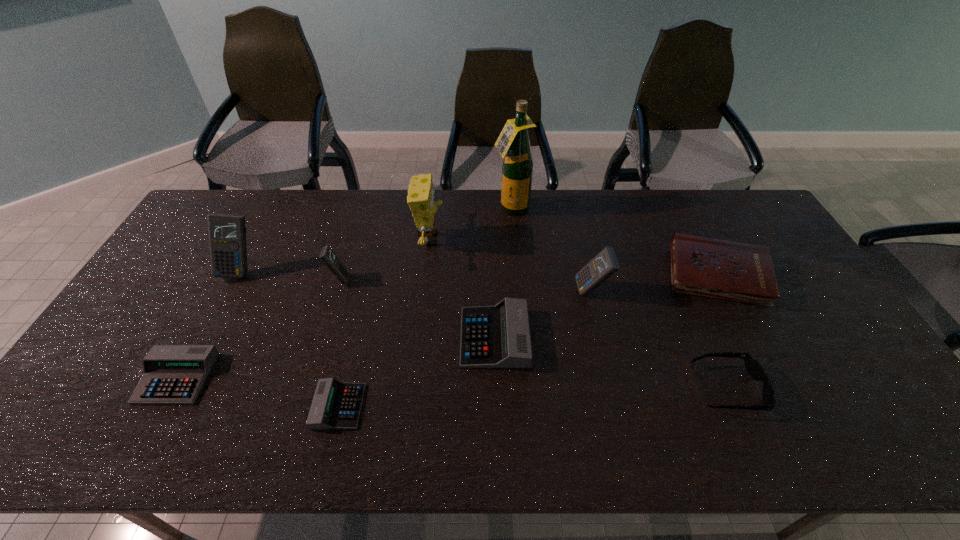
I want to click on object that ranks as the fourth closest to the second gray calculator from right to left, so click(x=421, y=194).

Identify the location of the closest object to the tallest object. (421, 194).

Identify the location of calculator that is the third closest to the tallest object. (328, 257).

Point out which calculator is positioned as the second nearest to the shortest object. Please provide its 2D coordinates. Your answer should be formatted as a tuple, i.e. [(x, y)], where the tuple contains the x and y coordinates of a point satisfying the conditions above.

[(172, 374)]

Locate which blue calculator is the second closest to the biggest blue calculator. Please provide its 2D coordinates. Your answer should be formatted as a tuple, i.e. [(x, y)], where the tuple contains the x and y coordinates of a point satisfying the conditions above.

[(603, 265)]

The image size is (960, 540). I want to click on blue calculator that is the second closest to the rightmost gray calculator, so click(x=328, y=257).

Point out which gray calculator is positioned as the second nearest to the third shortest calculator. Please provide its 2D coordinates. Your answer should be formatted as a tuple, i.e. [(x, y)], where the tuple contains the x and y coordinates of a point satisfying the conditions above.

[(172, 374)]

Identify the location of gray calculator that stands as the second closest to the smallest blue calculator. The image size is (960, 540). (336, 405).

Find the location of a particular element. This screenshot has height=540, width=960. free space in the image that satisfies the following two spatial constraints: 1. on the face of the yellow sponge; 2. on the back side of the hardback book is located at coordinates (426, 275).

Locate an element on the screen. The height and width of the screenshot is (540, 960). vacant point that satisfies the following two spatial constraints: 1. on the front-facing side of the eighth object from left to right; 2. on the front side of the rightmost gray calculator is located at coordinates (603, 338).